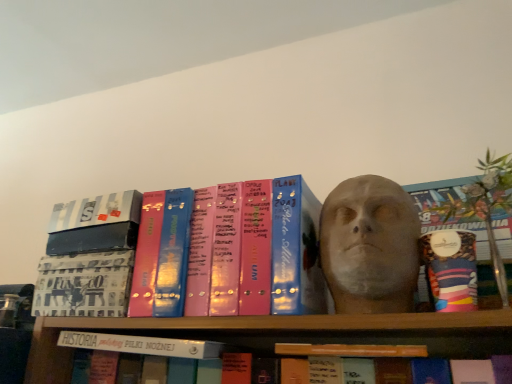
Question: Is metallic silver book at upper left, which appears as the second book when viewed from the left, positioned in front of green leafy plant at upper right?

Choices:
 (A) no
 (B) yes

Answer: (A)

Question: Can you confirm if metallic silver book at upper left, which appears as the second book when viewed from the left, is wider than green leafy plant at upper right?

Choices:
 (A) no
 (B) yes

Answer: (B)

Question: Is metallic silver book at upper left, which appears as the second book when viewed from the left, facing away from green leafy plant at upper right?

Choices:
 (A) yes
 (B) no

Answer: (B)

Question: Would you say metallic silver book at upper left, which appears as the second book when viewed from the left, is outside green leafy plant at upper right?

Choices:
 (A) yes
 (B) no

Answer: (A)

Question: Is metallic silver book at upper left, which appears as the fourth book when viewed from the right, with green leafy plant at upper right?

Choices:
 (A) no
 (B) yes

Answer: (A)

Question: Considering the relative sizes of metallic silver book at upper left, which appears as the fourth book when viewed from the right, and green leafy plant at upper right in the image provided, is metallic silver book at upper left, which appears as the fourth book when viewed from the right, smaller than green leafy plant at upper right?

Choices:
 (A) yes
 (B) no

Answer: (A)

Question: From the image's perspective, is metallic silver book at upper left, which appears as the second book when viewed from the left, on top of patterned fabric book at center, acting as the first book starting from the left?

Choices:
 (A) no
 (B) yes

Answer: (B)

Question: From the image's perspective, is metallic silver book at upper left, which appears as the fourth book when viewed from the right, located beneath patterned fabric book at center, the 5th book in the right-to-left sequence?

Choices:
 (A) no
 (B) yes

Answer: (A)

Question: Does metallic silver book at upper left, which appears as the second book when viewed from the left, appear on the left side of patterned fabric book at center, the 5th book in the right-to-left sequence?

Choices:
 (A) yes
 (B) no

Answer: (B)

Question: From a real-world perspective, is metallic silver book at upper left, which appears as the second book when viewed from the left, under patterned fabric book at center, the 5th book in the right-to-left sequence?

Choices:
 (A) no
 (B) yes

Answer: (A)

Question: Is metallic silver book at upper left, which appears as the fourth book when viewed from the right, in contact with patterned fabric book at center, acting as the first book starting from the left?

Choices:
 (A) yes
 (B) no

Answer: (B)

Question: Is metallic silver book at upper left, which appears as the second book when viewed from the left, oriented away from patterned fabric book at center, the 5th book in the right-to-left sequence?

Choices:
 (A) no
 (B) yes

Answer: (A)

Question: Is matte pink binder at center, arranged as the second book when viewed from the right, at the right side of white matte book at center, marked as the 3th book in a right-to-left arrangement?

Choices:
 (A) no
 (B) yes

Answer: (B)